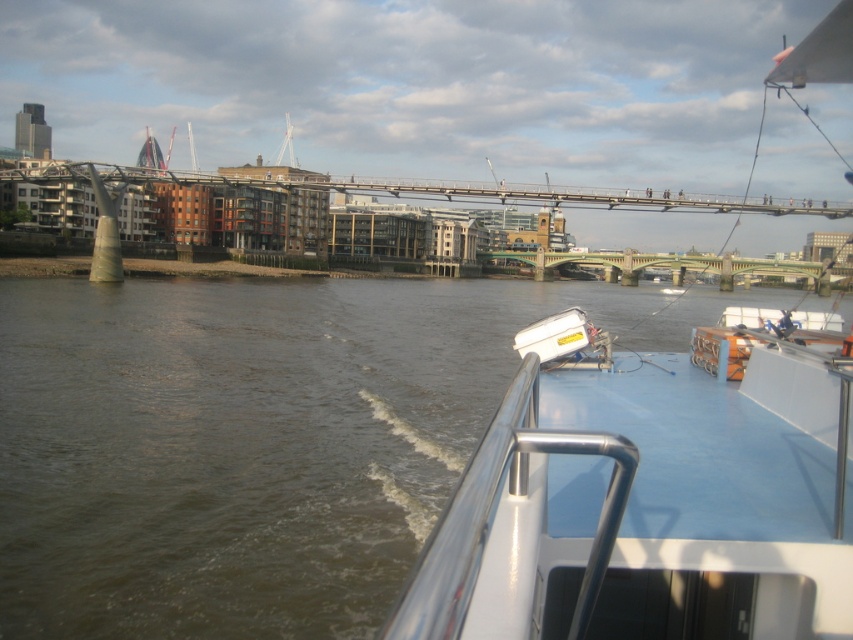
You are standing on the boat deck and looking towards the direction of the boat movement. Which direction should you turn to locate the brown water at lower left?

You should turn to your left because the brown water at lower left is located at the lower left position relative to the boat deck.